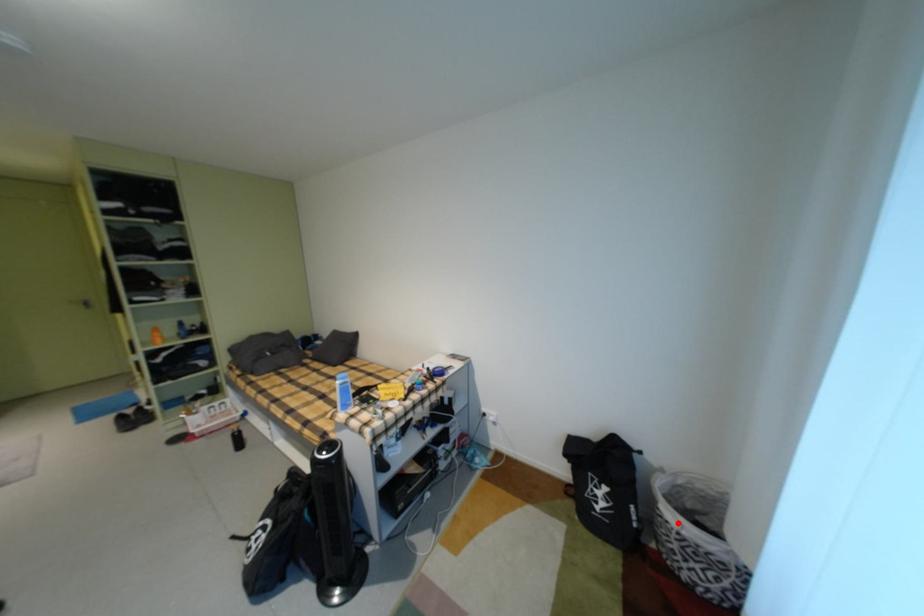
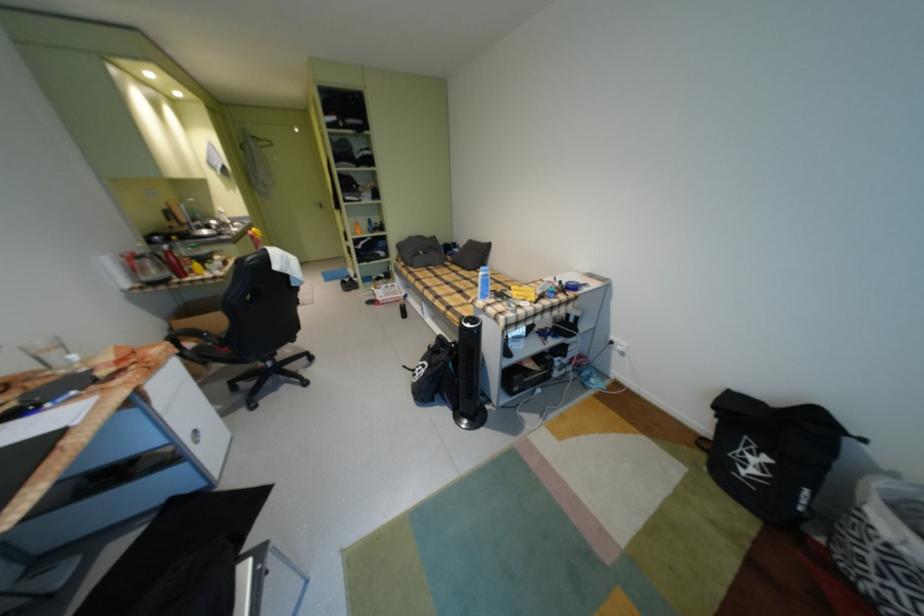
The point at the highlighted location is marked in the first image. Where is the corresponding point in the second image?

(882, 529)